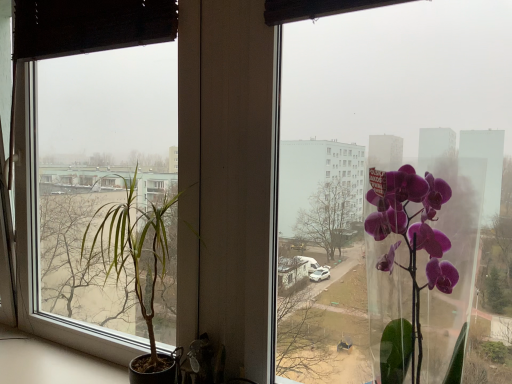
Measure the distance between green leafy plant at left and camera.

A distance of 38.56 inches exists between green leafy plant at left and camera.

Identify the location of green leafy plant at left. (138, 268).

Image resolution: width=512 pixels, height=384 pixels. I want to click on transparent glass window at center, so click(397, 194).

From the image's perspective, is transparent glass vase at right over transparent glass window at center?

No, from the image's perspective, transparent glass vase at right is not on top of transparent glass window at center.

From the picture: Between transparent glass vase at right and transparent glass window at center, which one appears on the left side from the viewer's perspective?

From the viewer's perspective, transparent glass window at center appears more on the left side.

In terms of height, does transparent glass vase at right look taller or shorter compared to transparent glass window at center?

transparent glass vase at right is shorter than transparent glass window at center.

Is transparent glass vase at right turned away from transparent glass window at center?

No, transparent glass vase at right is not facing away from transparent glass window at center.

How different are the orientations of transparent glass window at center and transparent glass vase at right in degrees?

They differ by 0.181 degrees in their facing directions.

Which is behind, transparent glass window at center or transparent glass vase at right?

transparent glass window at center is more distant.

Does transparent glass window at center have a lesser width compared to transparent glass vase at right?

Correct, the width of transparent glass window at center is less than that of transparent glass vase at right.

Can we say transparent glass window at center lies outside transparent glass vase at right?

transparent glass window at center lies outside transparent glass vase at right's area.

From the picture: How many degrees apart are the facing directions of transparent glass window at center and green leafy plant at left?

There is a 0.293-degree angle between the facing directions of transparent glass window at center and green leafy plant at left.

From the picture: Is transparent glass window at center aimed at green leafy plant at left?

No, transparent glass window at center does not turn towards green leafy plant at left.

Would you say transparent glass window at center is outside green leafy plant at left?

Yes, transparent glass window at center is not within green leafy plant at left.

Is transparent glass window at center positioned far away from green leafy plant at left?

Yes, transparent glass window at center and green leafy plant at left are quite far apart.

Based on their sizes in the image, would you say green leafy plant at left is bigger or smaller than transparent glass vase at right?

Considering their sizes, green leafy plant at left takes up more space than transparent glass vase at right.

From the image's perspective, would you say green leafy plant at left is shown under transparent glass vase at right?

Indeed, from the image's perspective, green leafy plant at left is shown beneath transparent glass vase at right.

Based on the photo, considering the sizes of objects green leafy plant at left and transparent glass vase at right in the image provided, who is wider, green leafy plant at left or transparent glass vase at right?

With larger width is green leafy plant at left.

Is green leafy plant at left positioned far away from transparent glass vase at right?

No, green leafy plant at left is not far from transparent glass vase at right.

Which is less distant, (x=145, y=210) or (x=392, y=167)?

Point (x=145, y=210) is closer to the camera than point (x=392, y=167).

Does green leafy plant at left have a lesser height compared to transparent glass window at center?

Incorrect, the height of green leafy plant at left does not fall short of that of transparent glass window at center.

From the picture: Can you tell me how much green leafy plant at left and transparent glass window at center differ in facing direction?

The angle between the facing direction of green leafy plant at left and the facing direction of transparent glass window at center is 0.293 degrees.

Measure the distance between green leafy plant at left and transparent glass window at center.

A distance of 2.95 meters exists between green leafy plant at left and transparent glass window at center.

Would you say transparent glass vase at right is outside green leafy plant at left?

transparent glass vase at right is positioned outside green leafy plant at left.

Is point (432, 305) more distant than point (181, 347)?

That is True.

From a real-world perspective, is transparent glass vase at right located beneath green leafy plant at left?

Incorrect, from a real-world perspective, transparent glass vase at right is higher than green leafy plant at left.

Considering the positions of objects transparent glass vase at right and green leafy plant at left in the image provided, who is more to the left, transparent glass vase at right or green leafy plant at left?

Positioned to the left is green leafy plant at left.

You are a GUI agent. You are given a task and a screenshot of the screen. Output one action in this format:
    pyautogui.click(x=<x>, y=<y>)
    Task: Click on the window that is above the transparent glass vase at right (from a real-world perspective)
    The height and width of the screenshot is (384, 512).
    Given the screenshot: What is the action you would take?
    pyautogui.click(x=397, y=194)

The width and height of the screenshot is (512, 384). In order to click on glass vase on the right of transparent glass window at center in this screenshot , I will do `click(409, 259)`.

Considering their positions, is transparent glass window at center positioned closer to green leafy plant at left than transparent glass vase at right?

The object closer to green leafy plant at left is transparent glass vase at right.

Estimate the real-world distances between objects in this image. Which object is further from transparent glass window at center, transparent glass vase at right or green leafy plant at left?

green leafy plant at left lies further to transparent glass window at center than the other object.

Based on their spatial positions, is green leafy plant at left or transparent glass window at center further from transparent glass vase at right?

transparent glass window at center is further to transparent glass vase at right.

From the image, which object appears to be farther from transparent glass window at center, green leafy plant at left or transparent glass vase at right?

green leafy plant at left.

Considering their positions, is transparent glass vase at right positioned further to green leafy plant at left than transparent glass window at center?

Based on the image, transparent glass window at center appears to be further to green leafy plant at left.

Which object lies further to the anchor point transparent glass vase at right, transparent glass window at center or green leafy plant at left?

Among the two, transparent glass window at center is located further to transparent glass vase at right.

Where is `window between green leafy plant at left and transparent glass vase at right in the horizontal direction`? The width and height of the screenshot is (512, 384). window between green leafy plant at left and transparent glass vase at right in the horizontal direction is located at coordinates (397, 194).